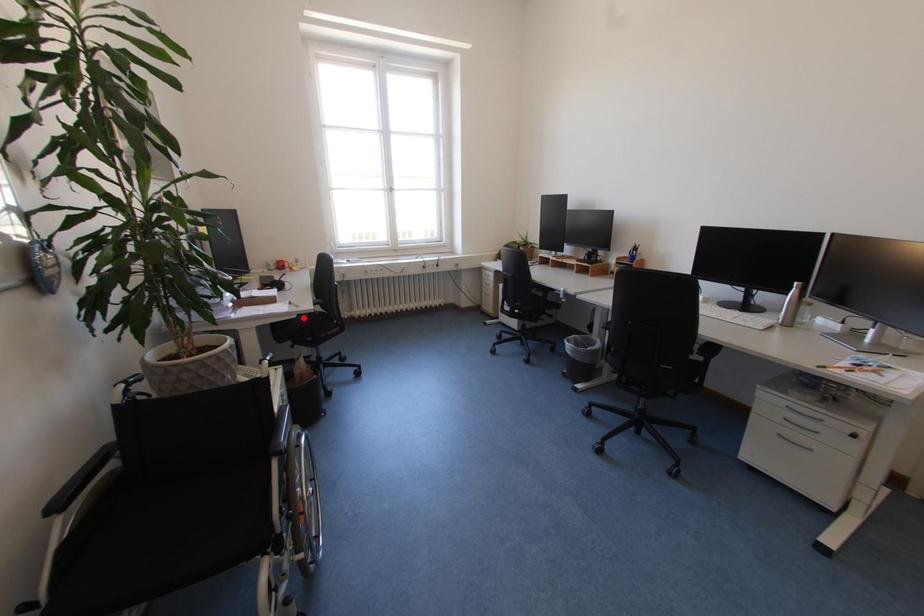
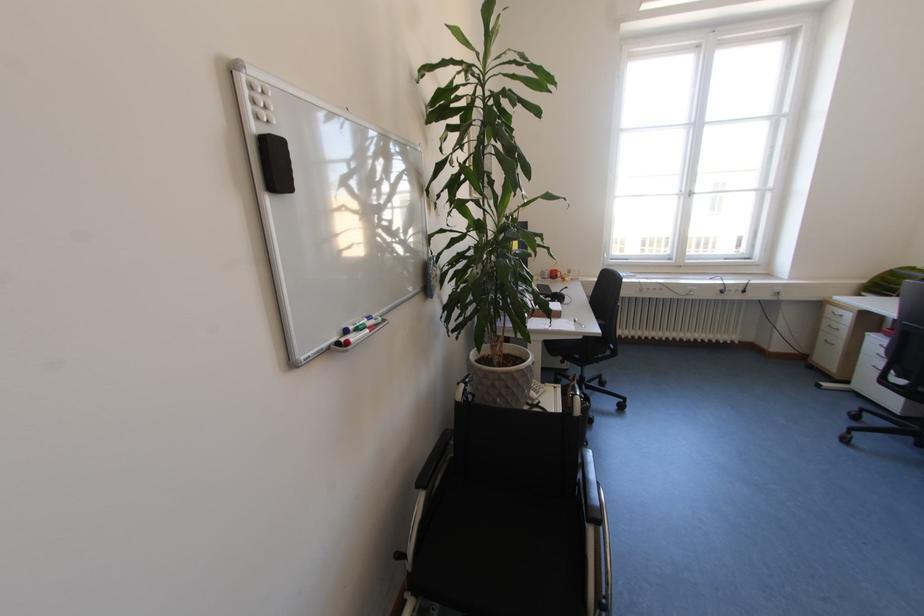
Question: I am providing you with two images of the same scene from different viewpoints. A red point is shown in image1. For the corresponding object point in image2, is it positioned nearer or farther from the camera?

Choices:
 (A) Nearer
 (B) Farther

Answer: (B)